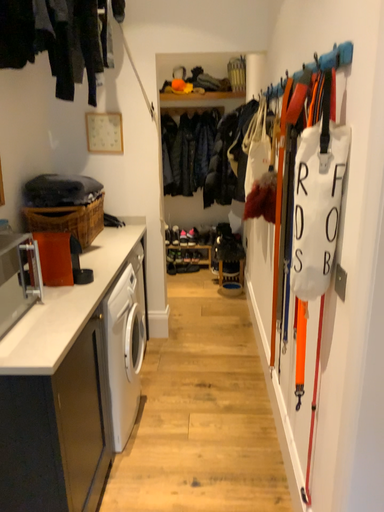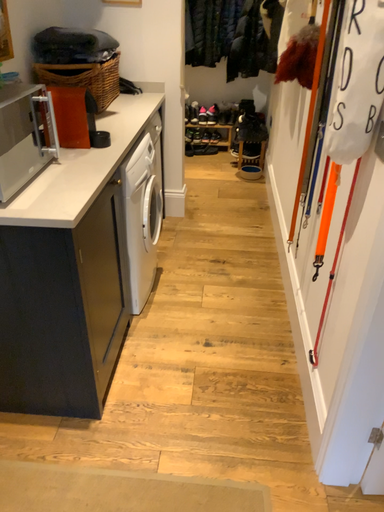
Question: Which way did the camera rotate in the video?

Choices:
 (A) rotated downward
 (B) rotated upward

Answer: (A)